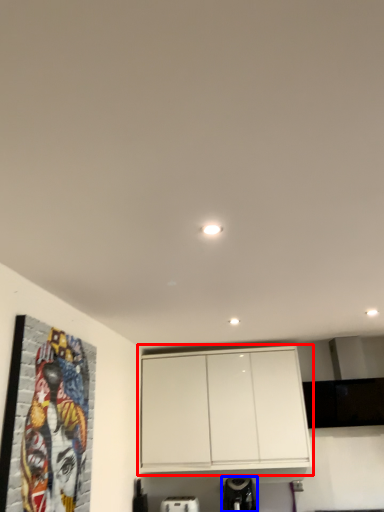
Question: Among these objects, which one is farthest to the camera, cabinetry (highlighted by a red box) or appliance (highlighted by a blue box)?

Choices:
 (A) cabinetry
 (B) appliance

Answer: (A)